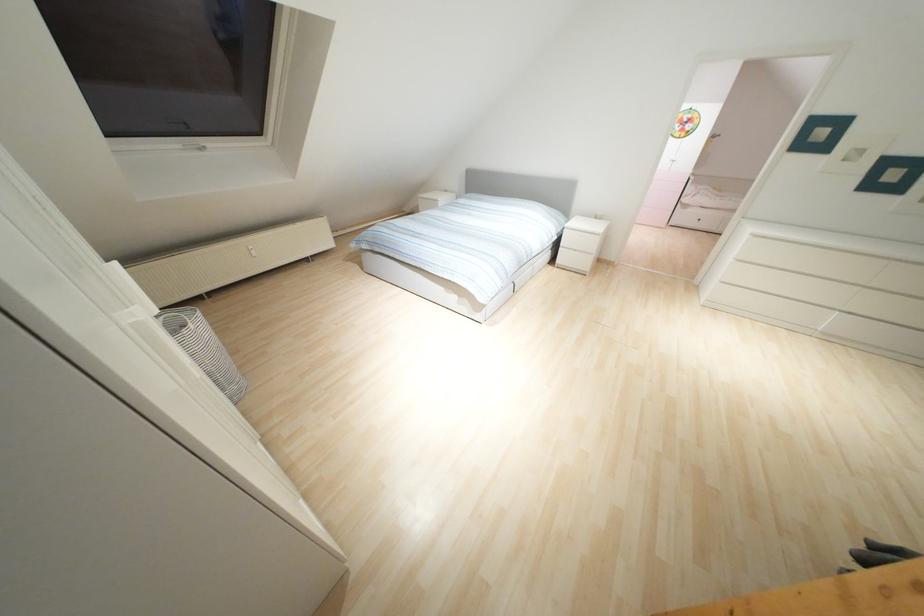
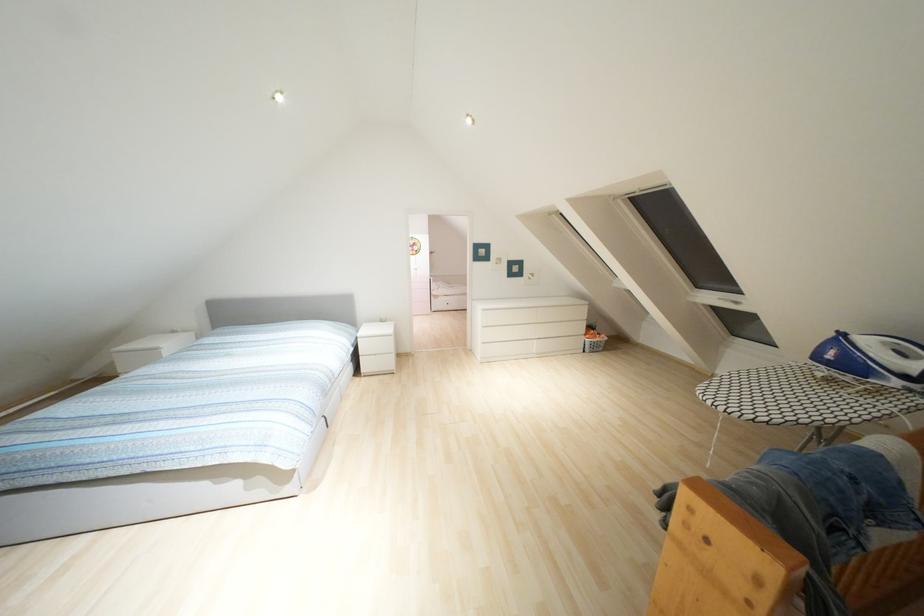
Question: The camera is either moving clockwise (left) or counter-clockwise (right) around the object. The first image is from the beginning of the video and the second image is from the end. Is the camera moving left or right when shooting the video?

Choices:
 (A) Left
 (B) Right

Answer: (A)